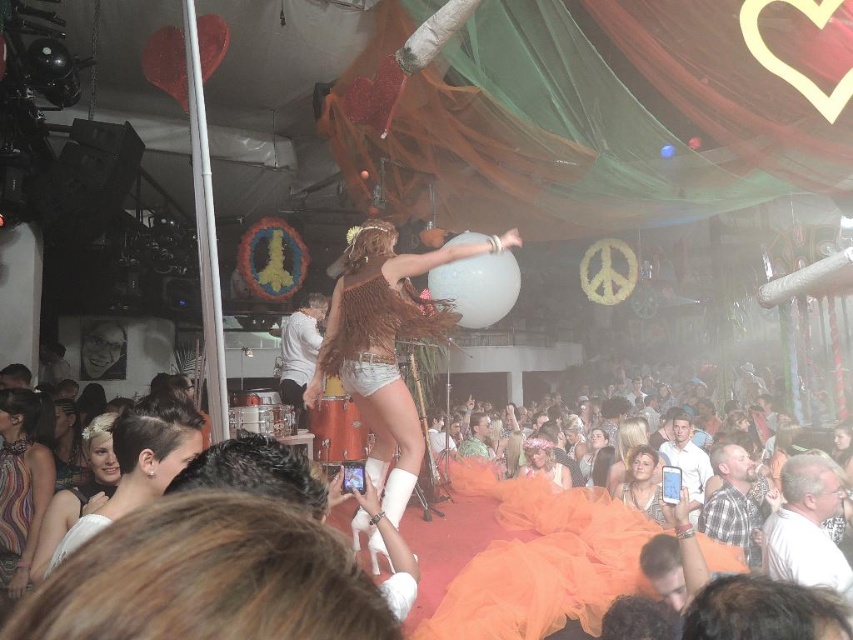
Question: Which of the following is the farthest from the observer?

Choices:
 (A) orange tulle dress at lower center
 (B) matte white dress at lower left
 (C) fuzzy brown hair at center
 (D) white tulle dress at lower left

Answer: (B)

Question: In this image, where is white lace dress at lower left located relative to matte white dress at lower left?

Choices:
 (A) right
 (B) left

Answer: (A)

Question: Which point is farther from the camera taking this photo?

Choices:
 (A) click(x=20, y=563)
 (B) click(x=61, y=484)
 (C) click(x=610, y=500)
 (D) click(x=631, y=445)

Answer: (D)

Question: Does blonde hair at center appear over white tulle dress at lower left?

Choices:
 (A) yes
 (B) no

Answer: (B)

Question: Does white matte hair at lower left appear over blonde hair at center?

Choices:
 (A) no
 (B) yes

Answer: (B)

Question: Which object is positioned farthest from the orange tulle dress at lower center?

Choices:
 (A) fuzzy brown hair at center
 (B) matte white dress at lower center
 (C) white lace dress at lower left

Answer: (C)